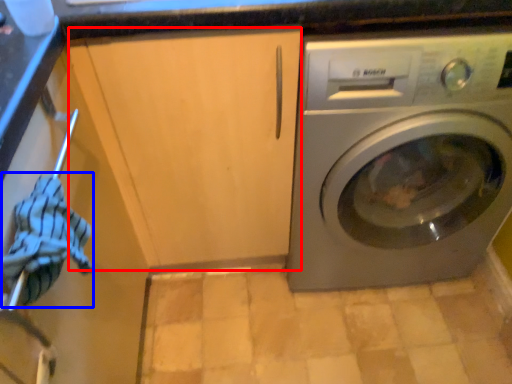
Question: Among these objects, which one is farthest to the camera, cabinetry (highlighted by a red box) or clothing (highlighted by a blue box)?

Choices:
 (A) cabinetry
 (B) clothing

Answer: (A)